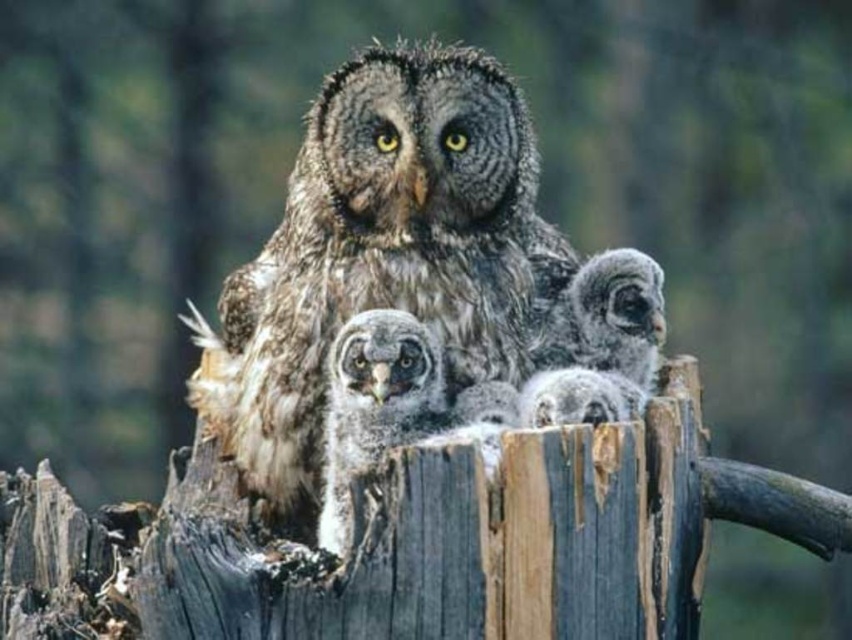
Who is positioned more to the right, speckled brown owl at center or speckled brown owl at right?

From the viewer's perspective, speckled brown owl at right appears more on the right side.

Is speckled brown owl at center smaller than speckled brown owl at right?

Actually, speckled brown owl at center might be larger than speckled brown owl at right.

Is point (320, 216) closer to viewer compared to point (649, 333)?

No, (320, 216) is further to viewer.

The image size is (852, 640). I want to click on speckled brown owl at center, so click(383, 252).

Consider the image. Can you confirm if speckled gray owl at center is positioned above speckled brown owl at right?

No.

Is point (347, 368) behind point (663, 330)?

No, it is in front of (663, 330).

Locate an element on the screen. Image resolution: width=852 pixels, height=640 pixels. speckled gray owl at center is located at coordinates (375, 404).

Does point (450, 380) come behind point (378, 348)?

Yes, point (450, 380) is farther from viewer.

From the picture: Is speckled brown owl at center below speckled gray owl at center?

No, speckled brown owl at center is not below speckled gray owl at center.

Is point (396, 227) farther from camera compared to point (343, 387)?

Yes, it is behind point (343, 387).

The image size is (852, 640). I want to click on speckled brown owl at center, so click(383, 252).